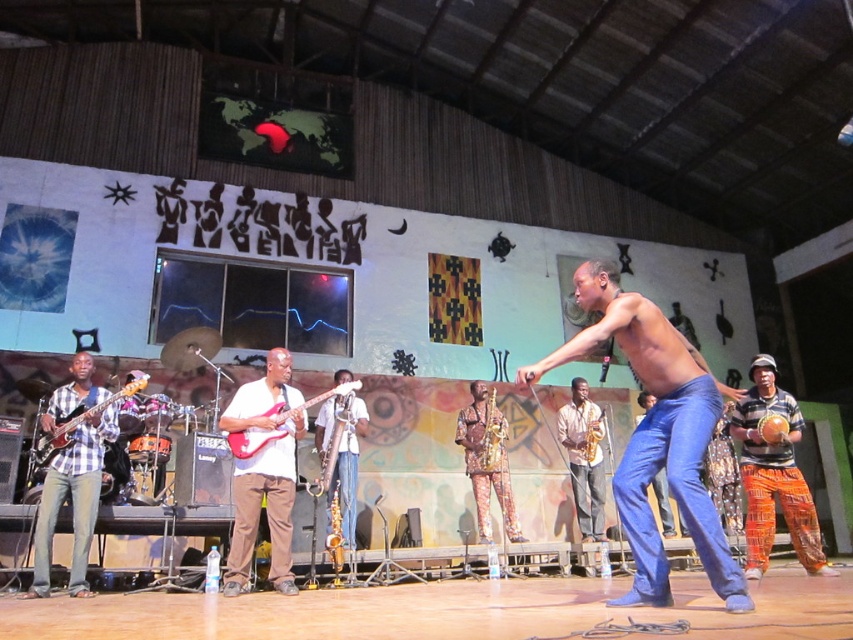
Is point (563, 428) farther from camera compared to point (230, 435)?

Yes, point (563, 428) is behind point (230, 435).

Does point (572, 444) lie in front of point (274, 419)?

No, (572, 444) is further to viewer.

Is point (561, 422) positioned after point (236, 444)?

Yes, point (561, 422) is behind point (236, 444).

Locate an element on the screen. Image resolution: width=853 pixels, height=640 pixels. gold saxophone at center is located at coordinates (584, 458).

Who is positioned more to the left, blue jeans at center or gold metallic saxophone at center?

From the viewer's perspective, gold metallic saxophone at center appears more on the left side.

Is point (654, 401) closer to viewer compared to point (595, 461)?

Yes.

The image size is (853, 640). In order to click on blue jeans at center in this screenshot , I will do `click(663, 502)`.

In the scene shown: Who is lower down, blue plaid shirt at left or matte red electric guitar at center?

blue plaid shirt at left is below.

Is point (115, 416) positioned in front of point (242, 449)?

No, (115, 416) is behind (242, 449).

What do you see at coordinates (73, 474) in the screenshot?
I see `blue plaid shirt at left` at bounding box center [73, 474].

Where is `blue plaid shirt at left`? The width and height of the screenshot is (853, 640). blue plaid shirt at left is located at coordinates (73, 474).